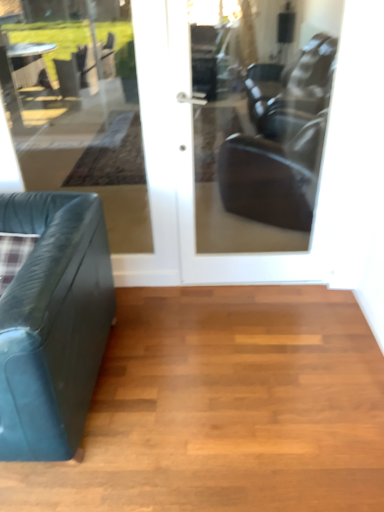
What are the coordinates of `free region under matte glass door at center (from a real-world perspective)` in the screenshot? It's located at (251, 284).